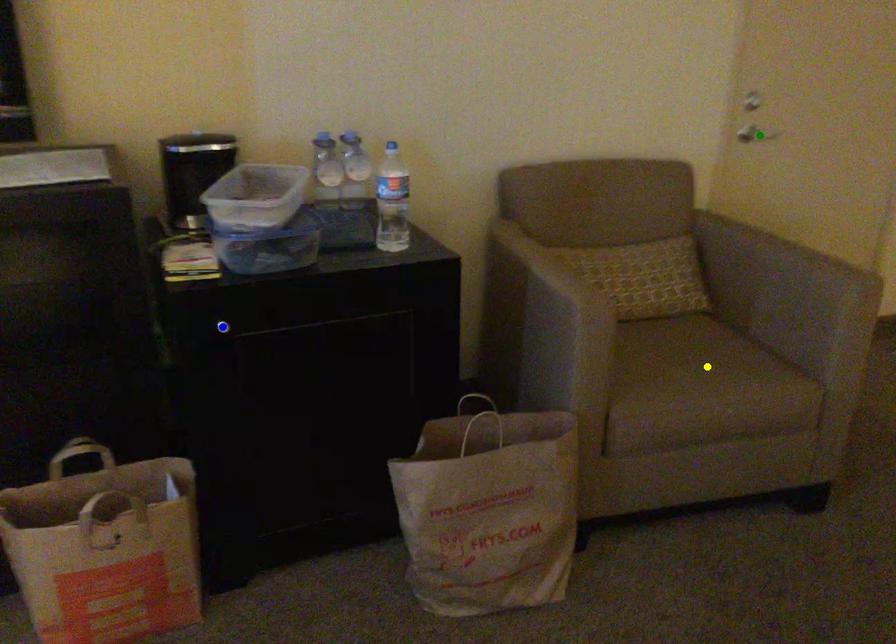
Order these from nearest to farthest:
yellow point
blue point
green point

green point, yellow point, blue point